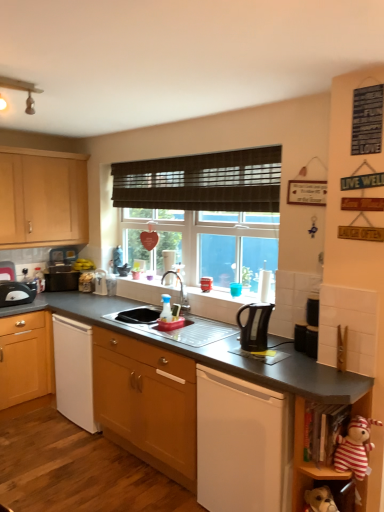
Identify the location of vacant space underneath black plastic toaster at left, which ranks as the 2th kitchen appliance in right-to-left order (from a real-world perspective). This screenshot has width=384, height=512. (24, 302).